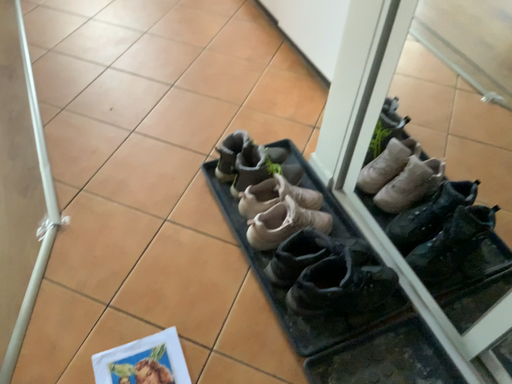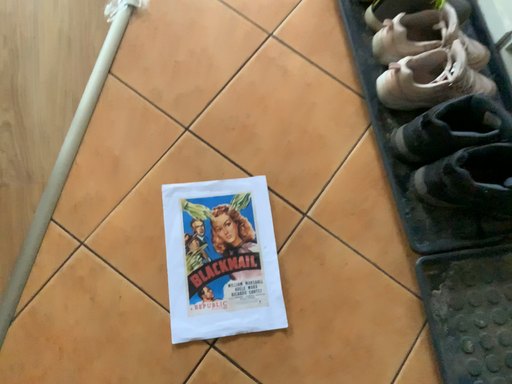
Question: Which way did the camera rotate in the video?

Choices:
 (A) rotated upward
 (B) rotated downward

Answer: (B)